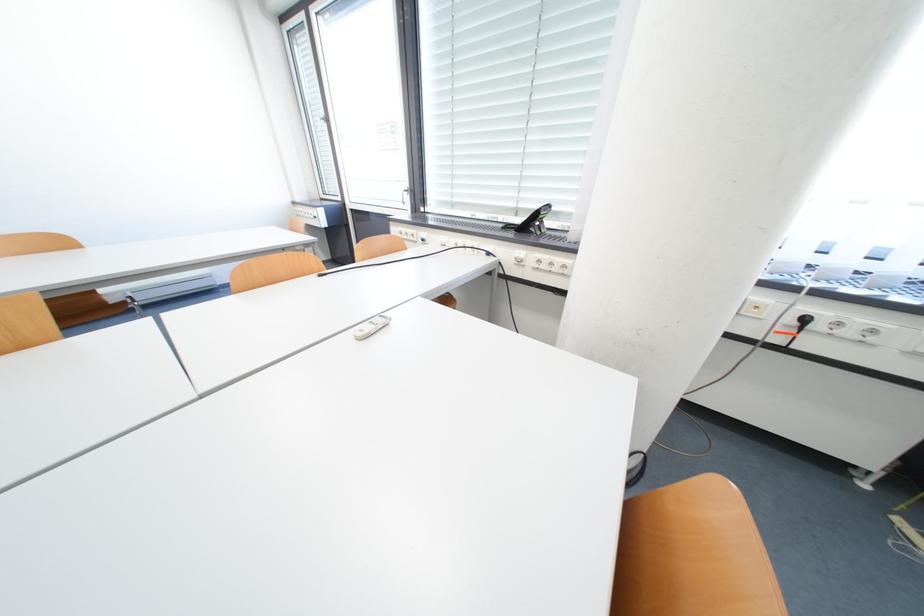
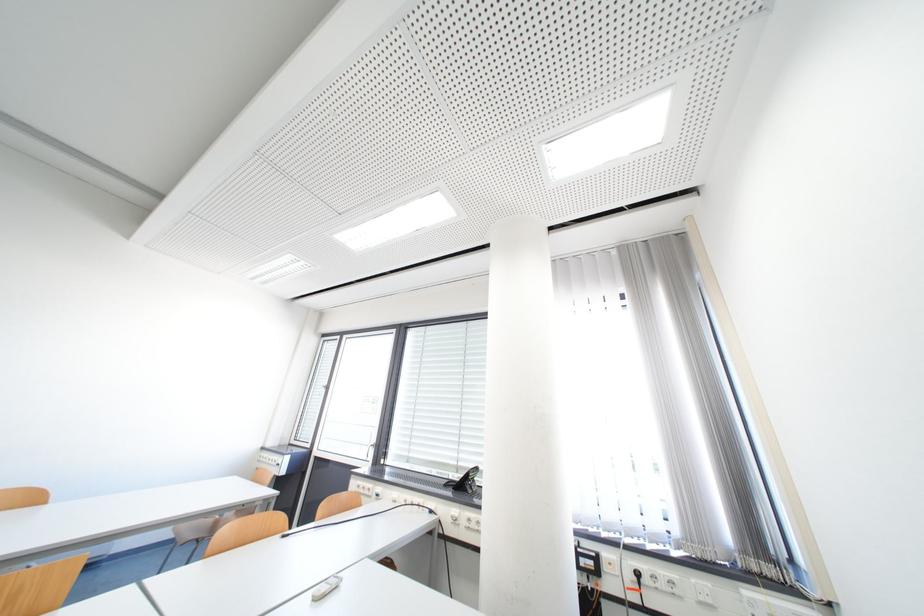
Question: How did the camera likely rotate?

Choices:
 (A) Left
 (B) Right
 (C) Up
 (D) Down

Answer: (C)